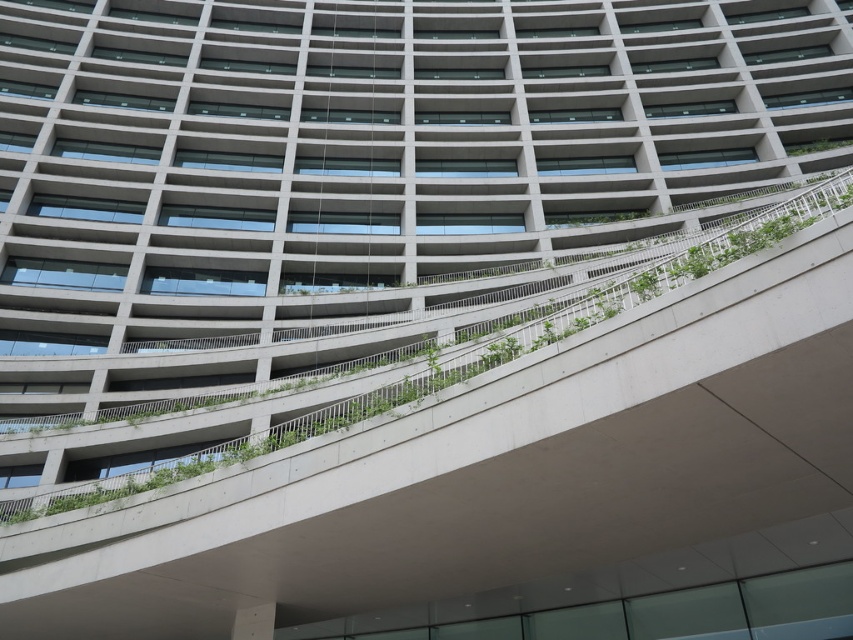
Is the position of green leafy plant at center more distant than that of green leafy plant at upper right?

That is False.

Does point (775, 209) come farther from viewer compared to point (793, 147)?

No.

Image resolution: width=853 pixels, height=640 pixels. I want to click on green leafy plant at center, so click(x=468, y=353).